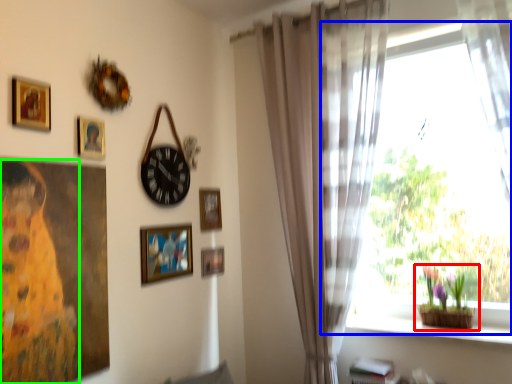
Question: Estimate the real-world distances between objects in this image. Which object is farther from houseplant (highlighted by a red box), window (highlighted by a blue box) or woman (highlighted by a green box)?

Choices:
 (A) window
 (B) woman

Answer: (B)